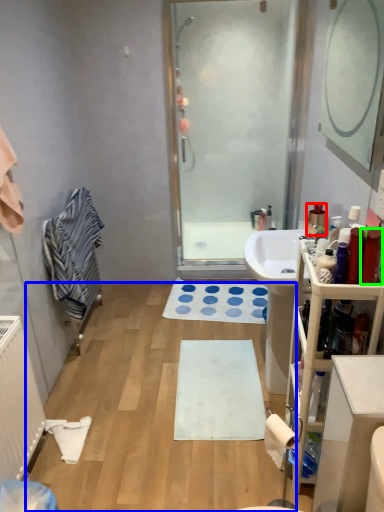
Question: Considering the real-world distances, which object is farthest from toiletry (highlighted by a red box)? plain (highlighted by a blue box) or toiletry (highlighted by a green box)?

Choices:
 (A) plain
 (B) toiletry

Answer: (A)